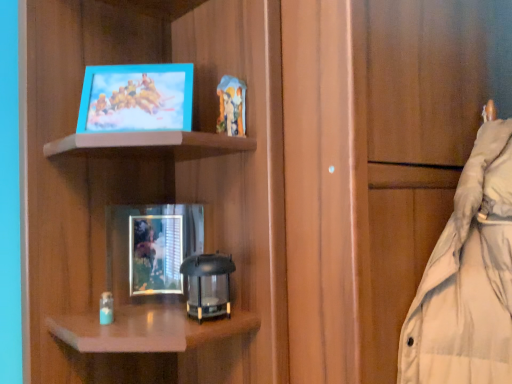
Question: Is metallic silver picture frame at center, which is the 2th picture frame from front to back, next to matte wood cabinet at center?

Choices:
 (A) no
 (B) yes

Answer: (A)

Question: Is metallic silver picture frame at center, which is the second picture frame in top-to-bottom order, at the right side of matte wood cabinet at center?

Choices:
 (A) yes
 (B) no

Answer: (B)

Question: From a real-world perspective, is metallic silver picture frame at center, which is the 1th picture frame in bottom-to-top order, positioned over matte wood cabinet at center based on gravity?

Choices:
 (A) yes
 (B) no

Answer: (B)

Question: Is matte wood cabinet at center completely or partially inside metallic silver picture frame at center, the 1th picture frame viewed from the back?

Choices:
 (A) no
 (B) yes

Answer: (A)

Question: Does metallic silver picture frame at center, the 1th picture frame viewed from the back, appear on the left side of matte wood cabinet at center?

Choices:
 (A) yes
 (B) no

Answer: (A)

Question: Is metallic silver picture frame at center, the 1th picture frame viewed from the back, outside matte wood cabinet at center?

Choices:
 (A) yes
 (B) no

Answer: (A)

Question: Is matte blue picture frame at upper left, positioned as the 2th picture frame in bottom-to-top order, aimed at metallic silver picture frame at center, the 1th picture frame viewed from the back?

Choices:
 (A) yes
 (B) no

Answer: (B)

Question: Does matte blue picture frame at upper left, marked as the 1th picture frame in a front-to-back arrangement, appear on the left side of metallic silver picture frame at center, which is the second picture frame in top-to-bottom order?

Choices:
 (A) no
 (B) yes

Answer: (B)

Question: Is matte blue picture frame at upper left, marked as the 1th picture frame in a front-to-back arrangement, located outside metallic silver picture frame at center, the 1th picture frame viewed from the back?

Choices:
 (A) no
 (B) yes

Answer: (B)

Question: Is matte blue picture frame at upper left, the second picture frame positioned from the back, turned away from metallic silver picture frame at center, which is the second picture frame in top-to-bottom order?

Choices:
 (A) no
 (B) yes

Answer: (A)

Question: Is the depth of matte blue picture frame at upper left, marked as the 1th picture frame in a front-to-back arrangement, greater than that of metallic silver picture frame at center, the 1th picture frame viewed from the back?

Choices:
 (A) no
 (B) yes

Answer: (A)

Question: From a real-world perspective, is matte blue picture frame at upper left, which is counted as the 1th picture frame, starting from the top, over metallic silver picture frame at center, which is the 2th picture frame from front to back?

Choices:
 (A) yes
 (B) no

Answer: (A)

Question: Are matte blue picture frame at upper left, marked as the 1th picture frame in a front-to-back arrangement, and matte wood cabinet at center beside each other?

Choices:
 (A) no
 (B) yes

Answer: (A)